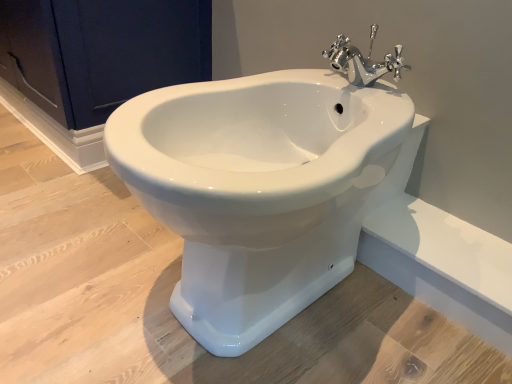
Identify the location of white glossy bidet at center. (262, 185).

In order to face white glossy bidet at center, should I rotate leftwards or rightwards?

Turn right by 0.493 degrees to look at white glossy bidet at center.

This screenshot has width=512, height=384. What do you see at coordinates (262, 185) in the screenshot? I see `white glossy bidet at center` at bounding box center [262, 185].

Where is `white glossy bidet at center`? This screenshot has width=512, height=384. white glossy bidet at center is located at coordinates (262, 185).